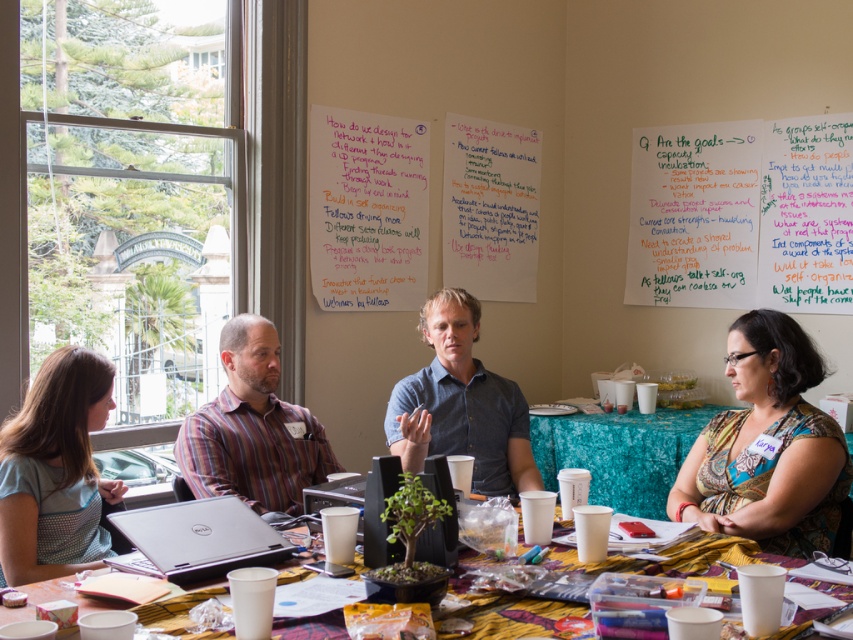
Is light blue cotton shirt at lower left closer to camera compared to plaid shirt at center?

Yes, it is.

Can you confirm if light blue cotton shirt at lower left is positioned above plaid shirt at center?

No.

Who is more distant from viewer, (51,570) or (305,444)?

The point (305,444) is more distant.

Find the location of a particular element. light blue cotton shirt at lower left is located at coordinates (55, 470).

Is point (796, 515) more distant than point (33, 516)?

Yes.

Where is `patterned fabric shirt at lower right`? patterned fabric shirt at lower right is located at coordinates (769, 445).

Can you confirm if plaid shirt at center is wider than blue denim shirt at center?

No, plaid shirt at center is not wider than blue denim shirt at center.

Between point (187, 438) and point (450, 394), which one is positioned behind?

The point (450, 394) is more distant.

Describe the element at coordinates (252, 428) in the screenshot. I see `plaid shirt at center` at that location.

Find the location of `plaid shirt at center`. plaid shirt at center is located at coordinates (252, 428).